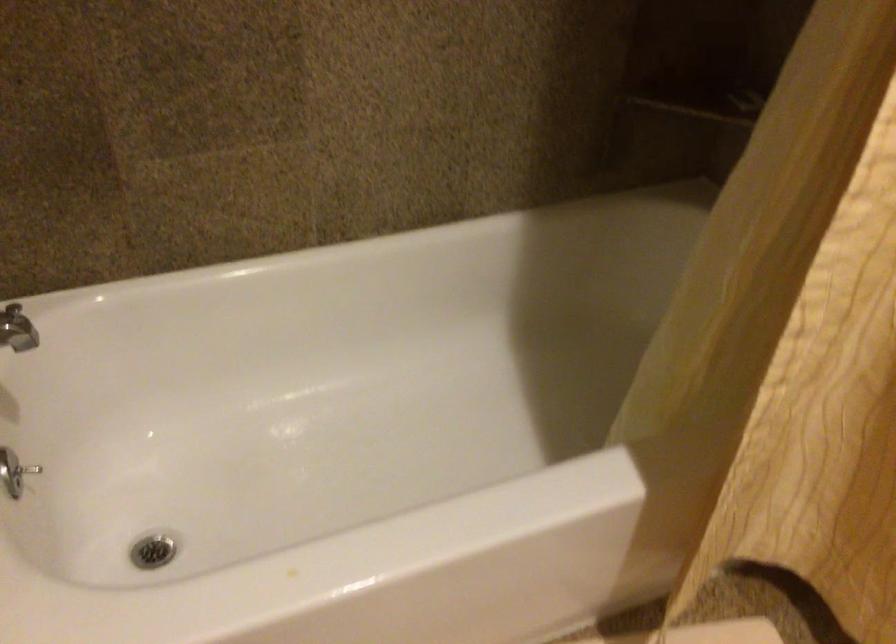
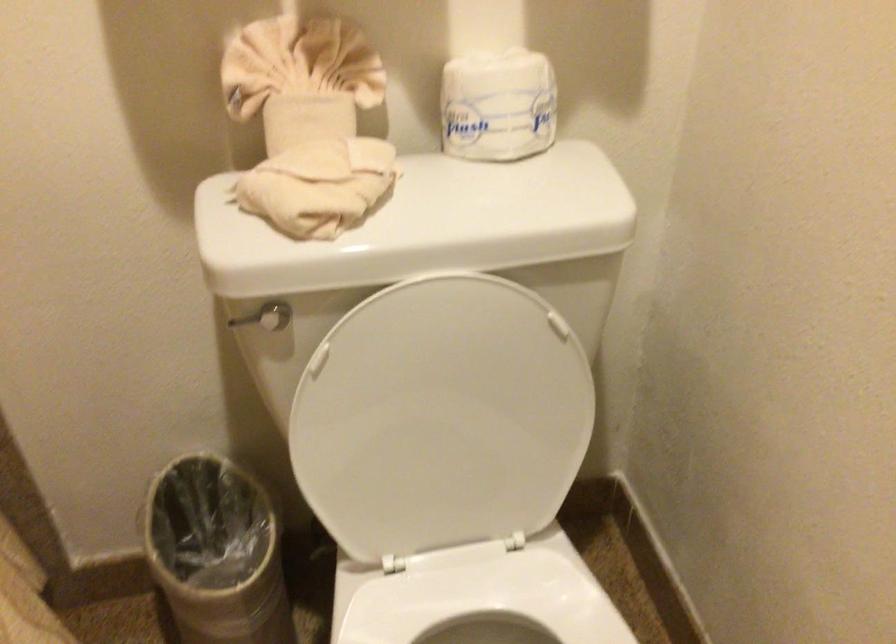
Looking at this image, how did the camera likely rotate?

The camera rotated toward right-down.